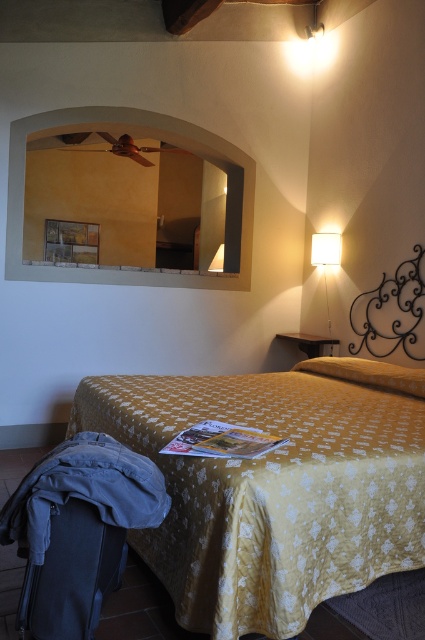
You are packing for a trip and have a matte black suitcase at lower left and a yellow fabric pillow at upper right. Which object has a smaller width?

The matte black suitcase at lower left has a smaller width than the yellow fabric pillow at upper right.

You are moving into this bedroom and need to place your new matte black suitcase at lower left. However, there is already a yellow floral fabric bed at lower left in the way. Can you move the bed to make space for the suitcase?

The yellow floral fabric bed at lower left is positioned over the matte black suitcase at lower left, meaning the bed is already covering the suitcase. Therefore, you cannot move the bed to make space for the suitcase because the suitcase is already underneath it.